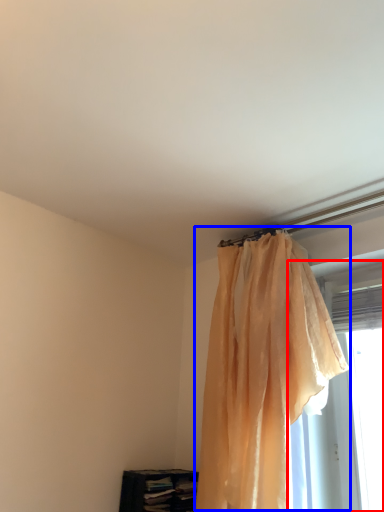
Question: Which object appears farthest to the camera in this image, window (highlighted by a red box) or curtain (highlighted by a blue box)?

Choices:
 (A) window
 (B) curtain

Answer: (A)